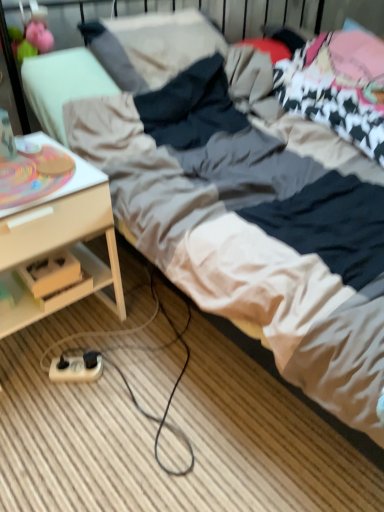
Find the location of `vacant area that lies between white wood desk at lower left and beige plastic extension cord at lower left`. vacant area that lies between white wood desk at lower left and beige plastic extension cord at lower left is located at coordinates (82, 354).